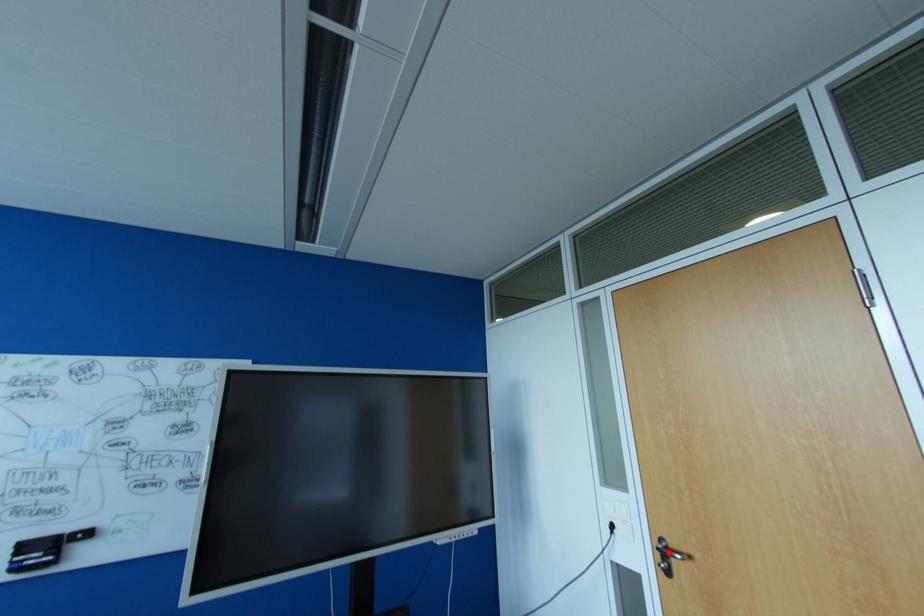
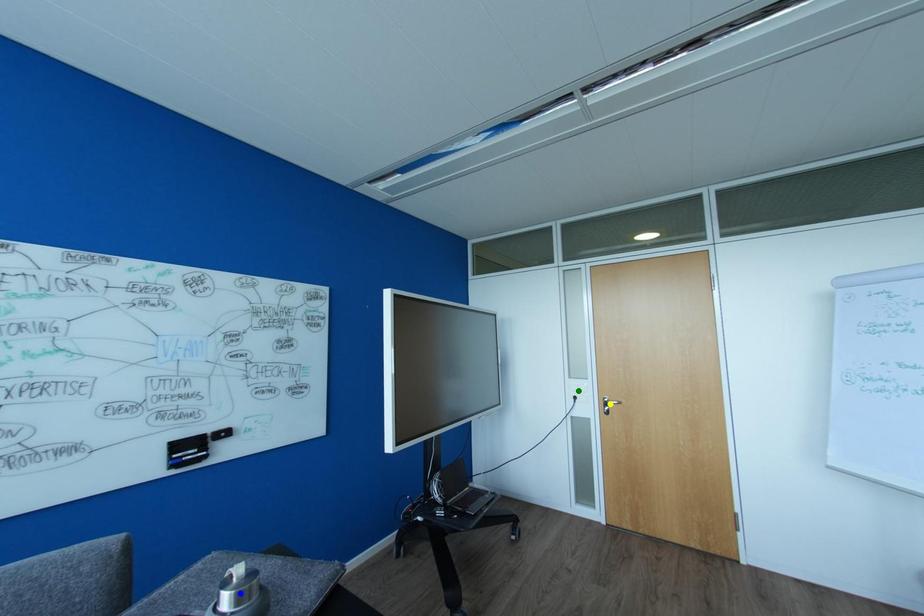
Question: I am providing you with two images of the same scene from different viewpoints. A red point is marked on the first image. You are given multiple points on the second image. In image 2, which mark is for the same physical point as the one in image 1?

Choices:
 (A) yellow point
 (B) green point
 (C) blue point

Answer: (A)